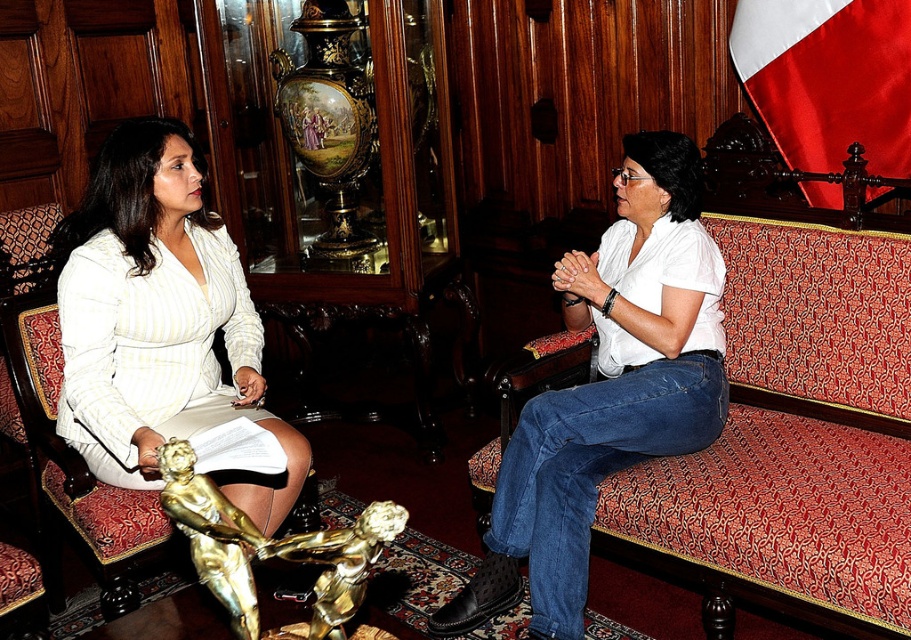
You are an interior designer planning to place a new sofa in the room. The red velvet couch at right and the white satin flag at upper right are already present. Which object takes up more space in the room?

The red velvet couch at right takes up more space in the room because it has a larger size compared to the white satin flag at upper right.

Please describe the location of the white cotton shirt at center in the image using coordinates. The coordinate system has the origin at the bottom left corner of the image, with x increasing to the right and y increasing upwards. The maximum x and y values are both 1.0. Please provide the coordinates as a pair of numbers between 0 and 1, separated by a comma.

The white cotton shirt at center is located at coordinates point (608, 390).

Based on the scene description, can you determine which object is placed above the other between the white satin flag at upper right and the gold metallic statue at lower center?

The white satin flag at upper right is positioned over the gold metallic statue at lower center, meaning it is placed above the statue.